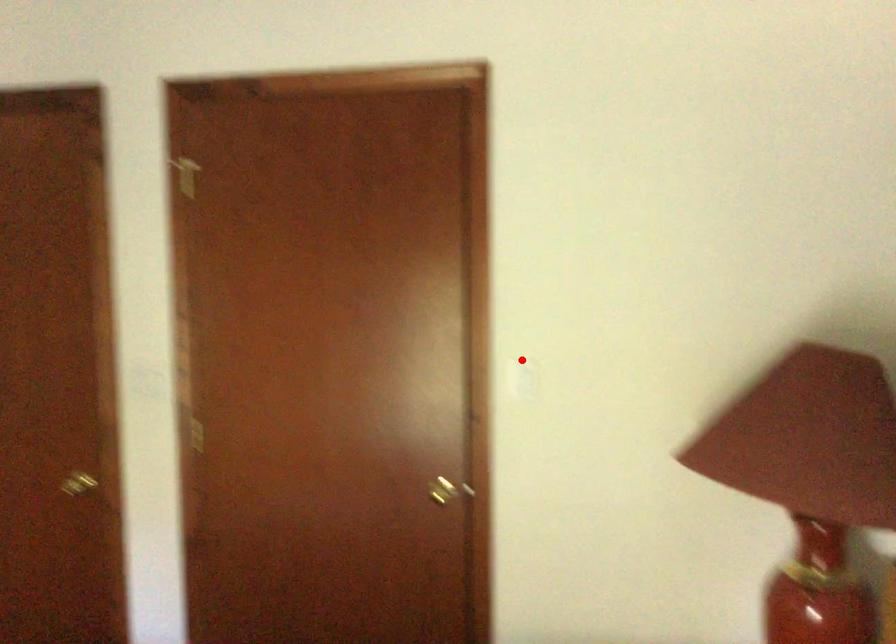
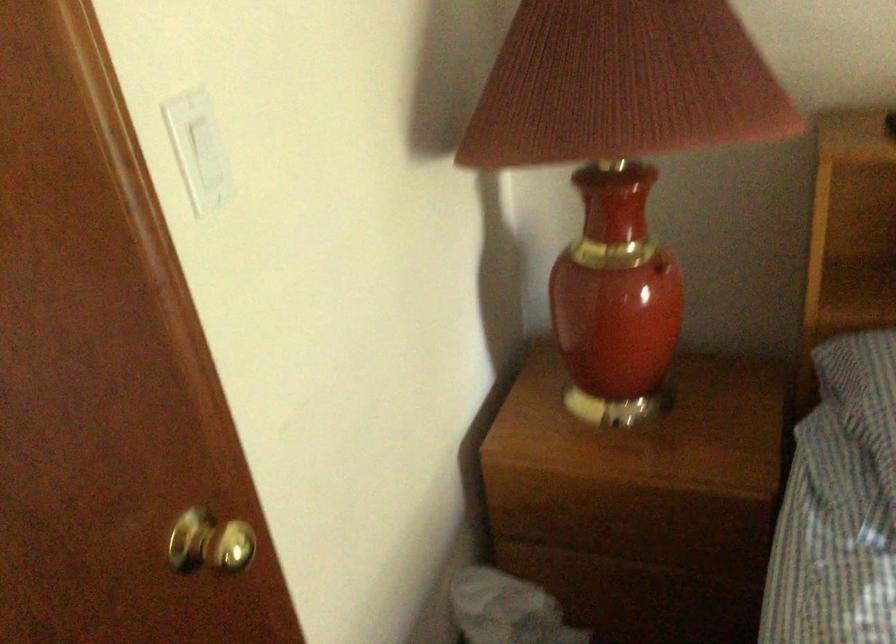
Question: I am providing you with two images of the same scene from different viewpoints. Image1 has a red point marked. In image2, the corresponding 3D location appears at what relative position? Reply with the corresponding letter.

Choices:
 (A) Closer
 (B) Farther

Answer: (A)